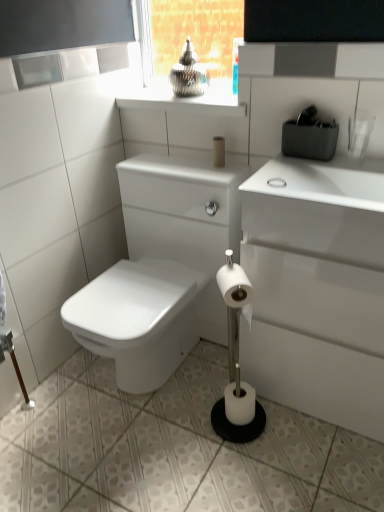
Where is `free spot to the left of matte beige toilet paper at center, the first toilet paper in the back-to-front sequence`? Image resolution: width=384 pixels, height=512 pixels. free spot to the left of matte beige toilet paper at center, the first toilet paper in the back-to-front sequence is located at coordinates (180, 165).